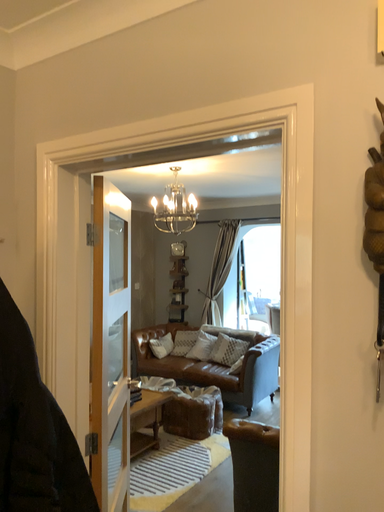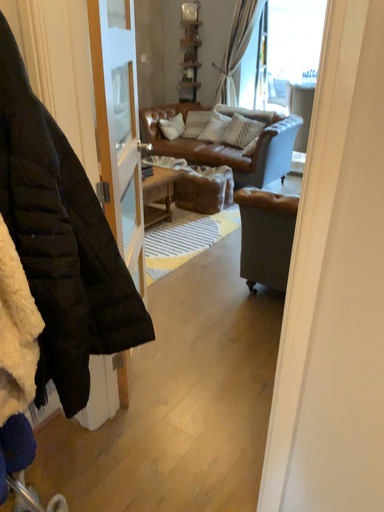
Question: Which way did the camera rotate in the video?

Choices:
 (A) rotated upward
 (B) rotated downward

Answer: (B)